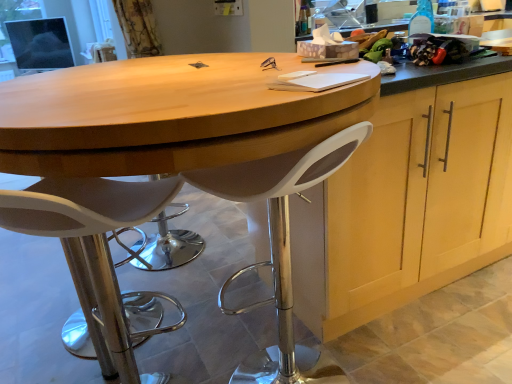
Where is `free space to the left of white plastic stool at center, the second chair viewed from the left`? free space to the left of white plastic stool at center, the second chair viewed from the left is located at coordinates (190, 356).